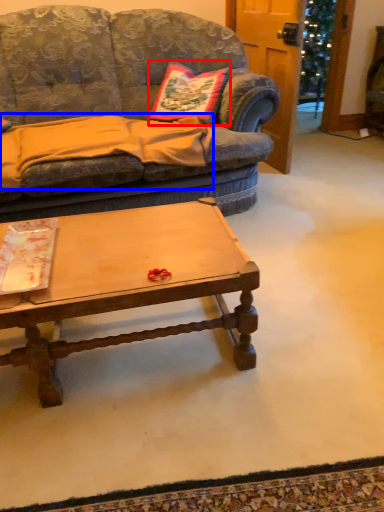
Question: Among these objects, which one is farthest to the camera, pillow (highlighted by a red box) or blanket (highlighted by a blue box)?

Choices:
 (A) pillow
 (B) blanket

Answer: (A)